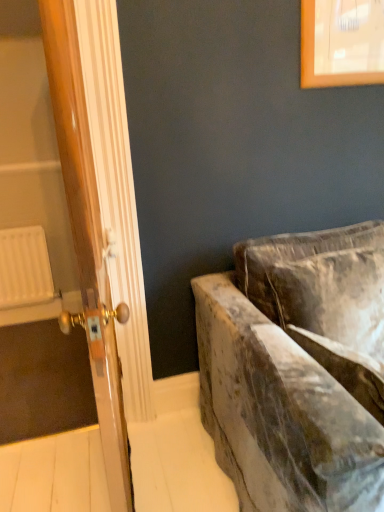
Question: From the image's perspective, is white plastic radiator at left above or below velvet couch at right?

Choices:
 (A) below
 (B) above

Answer: (B)

Question: Looking at the image, does white plastic radiator at left seem bigger or smaller compared to velvet couch at right?

Choices:
 (A) small
 (B) big

Answer: (A)

Question: Estimate the real-world distances between objects in this image. Which object is closer to the wooden door at left?

Choices:
 (A) velvet couch at right
 (B) white plastic radiator at left

Answer: (A)

Question: Estimate the real-world distances between objects in this image. Which object is farther from the wooden door at left?

Choices:
 (A) velvet couch at right
 (B) white plastic radiator at left

Answer: (B)